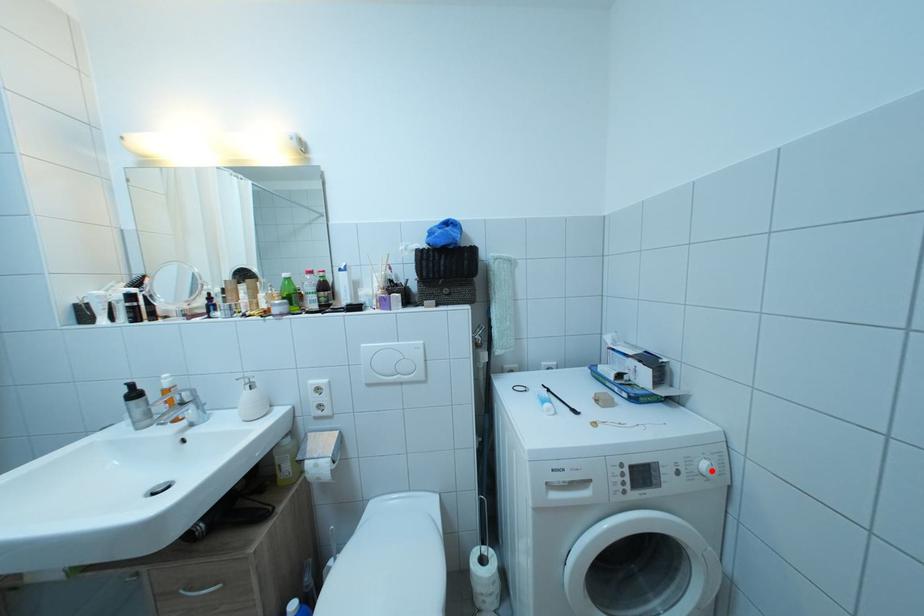
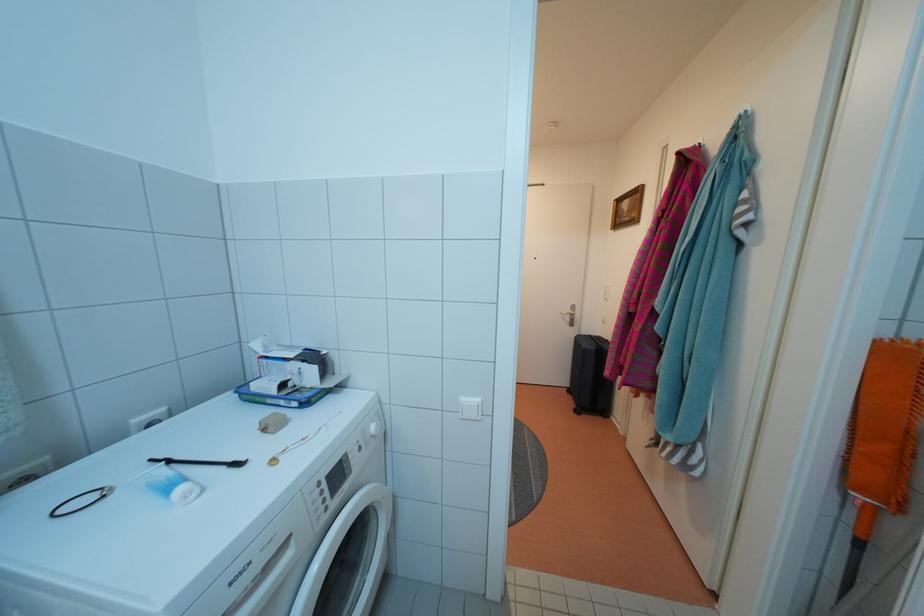
Where in the second image is the point corresponding to the highlighted location from the first image?

(380, 434)